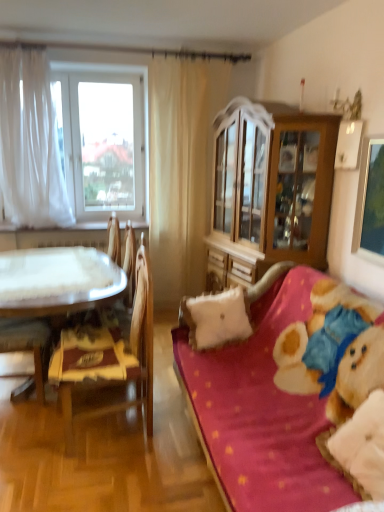
Question: Is white fluffy pillow at right, which is the 1th pillow from front to back, next to velvet pink couch at right and touching it?

Choices:
 (A) no
 (B) yes

Answer: (A)

Question: From a real-world perspective, is white fluffy pillow at right, arranged as the second pillow when viewed from the back, positioned under velvet pink couch at right based on gravity?

Choices:
 (A) no
 (B) yes

Answer: (A)

Question: From the image's perspective, is white fluffy pillow at right, which is the 1th pillow from front to back, below velvet pink couch at right?

Choices:
 (A) yes
 (B) no

Answer: (A)

Question: Does white fluffy pillow at right, arranged as the second pillow when viewed from the back, have a greater width compared to velvet pink couch at right?

Choices:
 (A) no
 (B) yes

Answer: (A)

Question: Is white fluffy pillow at right, the second pillow viewed from the left, shorter than velvet pink couch at right?

Choices:
 (A) no
 (B) yes

Answer: (B)

Question: Is white fluffy pillow at right, the second pillow viewed from the left, oriented towards velvet pink couch at right?

Choices:
 (A) yes
 (B) no

Answer: (A)

Question: Is white fluffy pillow at center, positioned as the 1th pillow in left-to-right order, to the right of white sheer curtain at left, positioned as the first curtain in left-to-right order, from the viewer's perspective?

Choices:
 (A) no
 (B) yes

Answer: (B)

Question: Is white fluffy pillow at center, positioned as the 1th pillow in left-to-right order, at the left side of white sheer curtain at left, the 2th curtain positioned from the right?

Choices:
 (A) yes
 (B) no

Answer: (B)

Question: Is the depth of white fluffy pillow at center, the 2th pillow viewed from the front, less than that of white sheer curtain at left, positioned as the first curtain in left-to-right order?

Choices:
 (A) no
 (B) yes

Answer: (B)

Question: Does white fluffy pillow at center, the 2th pillow viewed from the front, contain white sheer curtain at left, the 2th curtain positioned from the right?

Choices:
 (A) no
 (B) yes

Answer: (A)

Question: Can you confirm if white fluffy pillow at center, positioned as the 1th pillow in left-to-right order, is thinner than white sheer curtain at left, the 2th curtain positioned from the right?

Choices:
 (A) yes
 (B) no

Answer: (A)

Question: Is white fluffy pillow at center, positioned as the 1th pillow in left-to-right order, far from white sheer curtain at left, positioned as the first curtain in left-to-right order?

Choices:
 (A) no
 (B) yes

Answer: (B)

Question: Does white sheer curtain at left have a smaller size compared to velvet-like beige armchair at left?

Choices:
 (A) yes
 (B) no

Answer: (B)